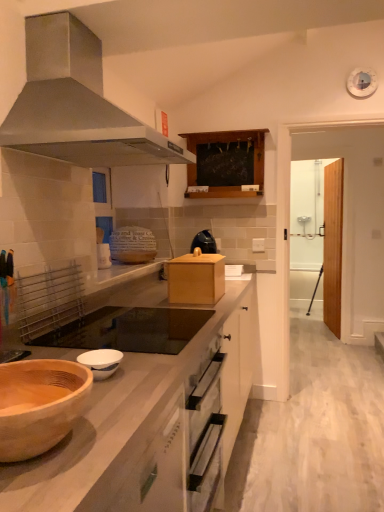
Where is `blank space situated above metallic stainless steel range hood at upper left (from a real-world perspective)`? Image resolution: width=384 pixels, height=512 pixels. blank space situated above metallic stainless steel range hood at upper left (from a real-world perspective) is located at coordinates [125, 24].